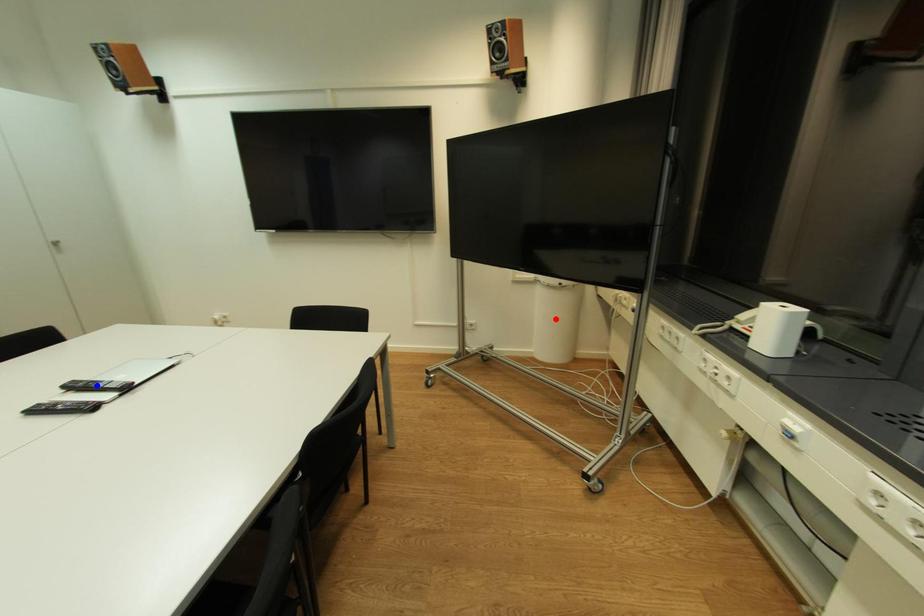
Question: In the image, two points are highlighted. Which point is nearer to the camera? Reply with the corresponding letter.

Choices:
 (A) blue point
 (B) red point

Answer: (A)